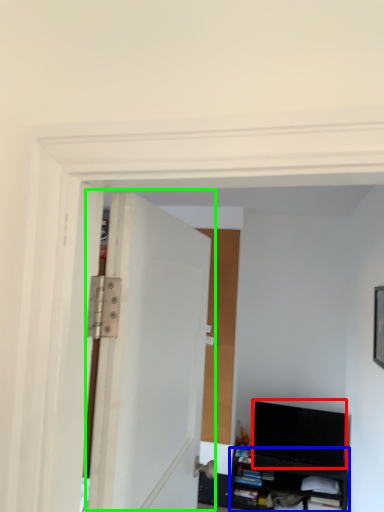
Question: Considering the real-world distances, which object is farthest from computer monitor (highlighted by a red box)? cabinetry (highlighted by a blue box) or door (highlighted by a green box)?

Choices:
 (A) cabinetry
 (B) door

Answer: (B)